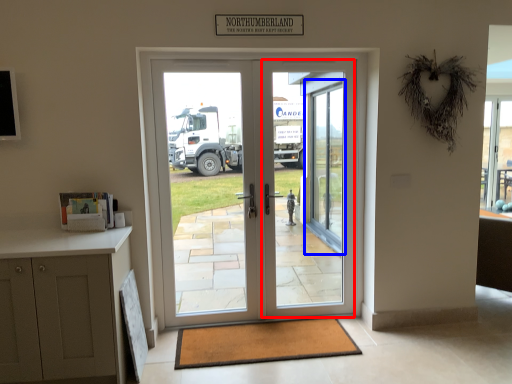
Question: Among these objects, which one is nearest to the camera, screen door (highlighted by a red box) or glass door (highlighted by a blue box)?

Choices:
 (A) screen door
 (B) glass door

Answer: (A)